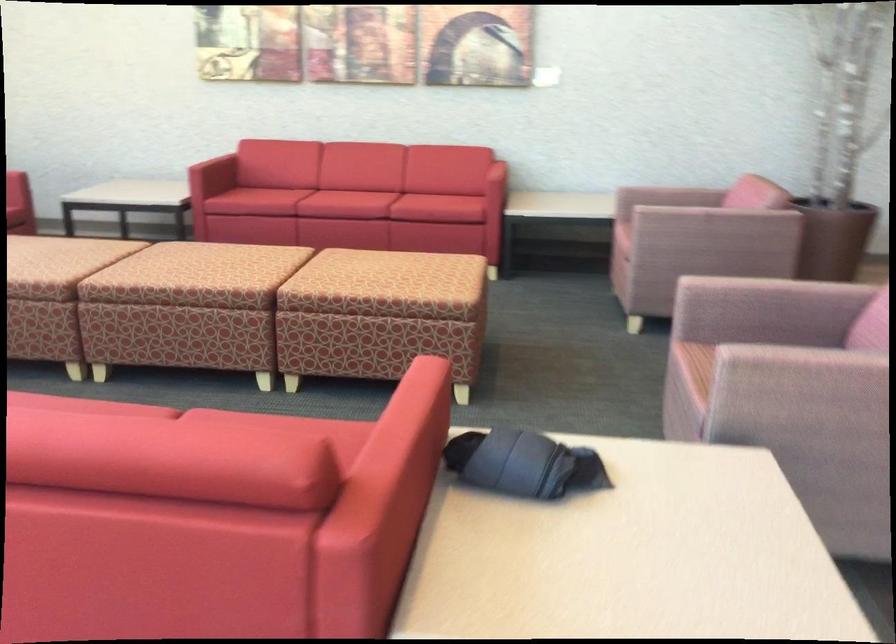
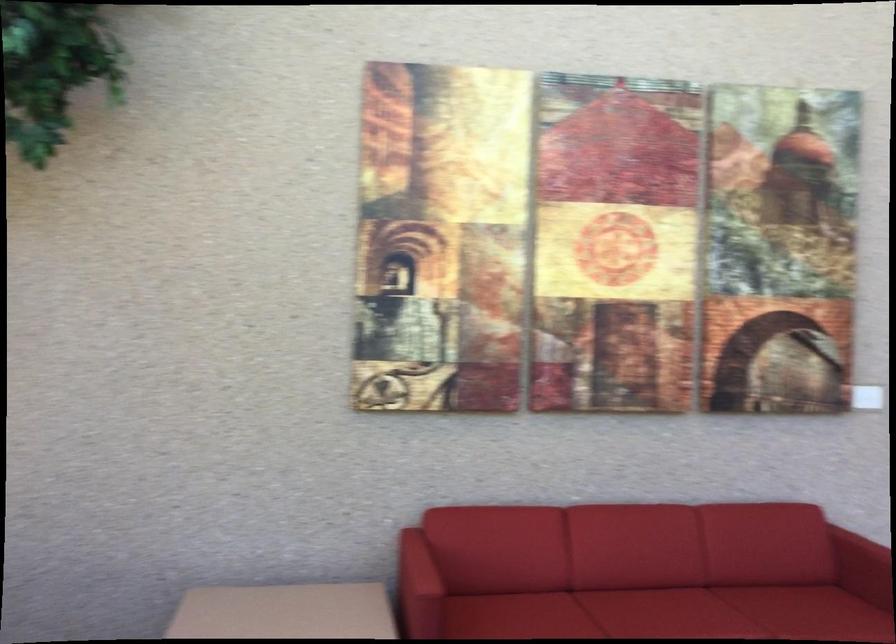
Locate, in the second image, the point that corresponds to (487,160) in the first image.

(864, 558)